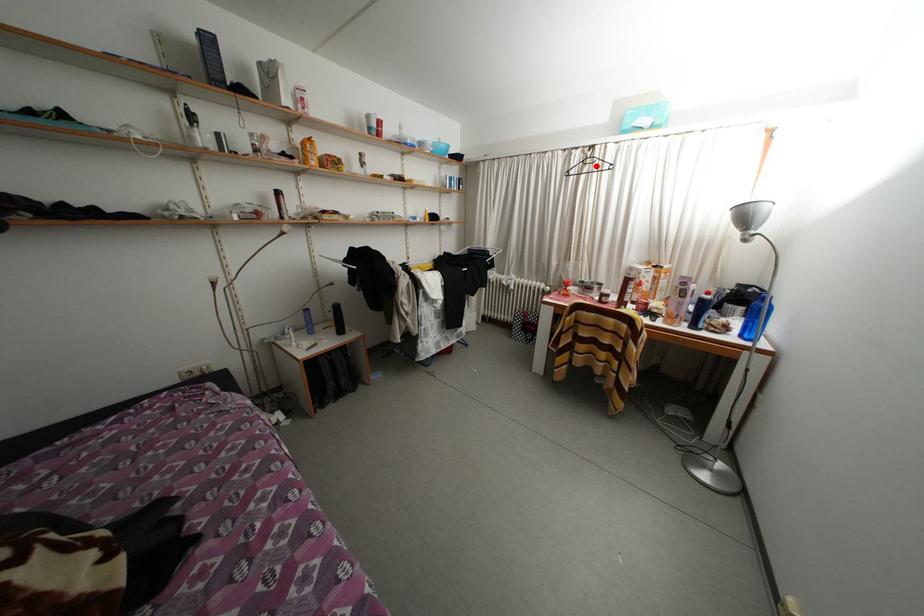
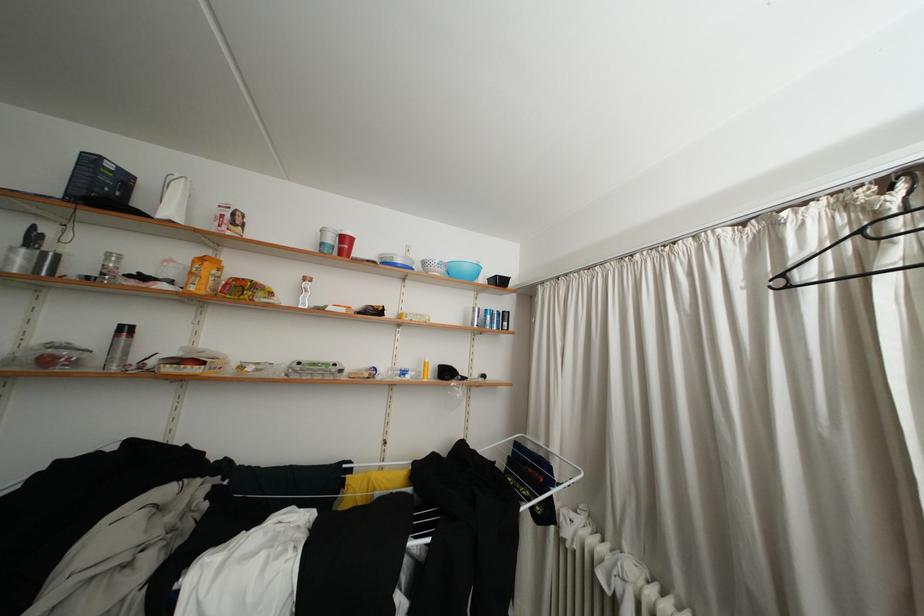
Where in the second image is the point corresponding to the highlighted location from the first image?

(906, 229)